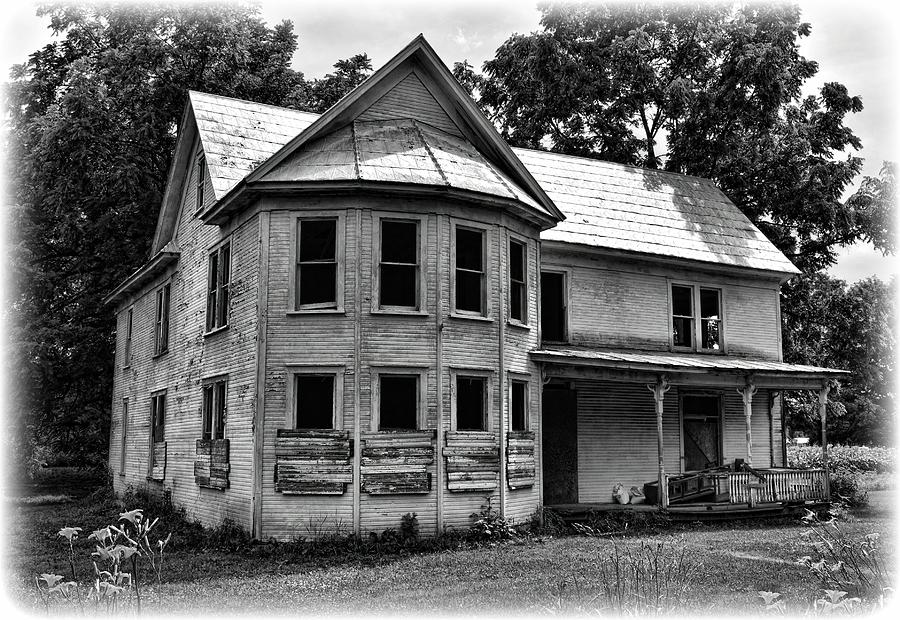
At what (x,y) coordinates should I click in order to perform the action: click on wood slats. Please return your answer as a coordinate pair (x, y). Image resolution: width=900 pixels, height=620 pixels. Looking at the image, I should click on (326, 467), (405, 467), (472, 470), (518, 472).